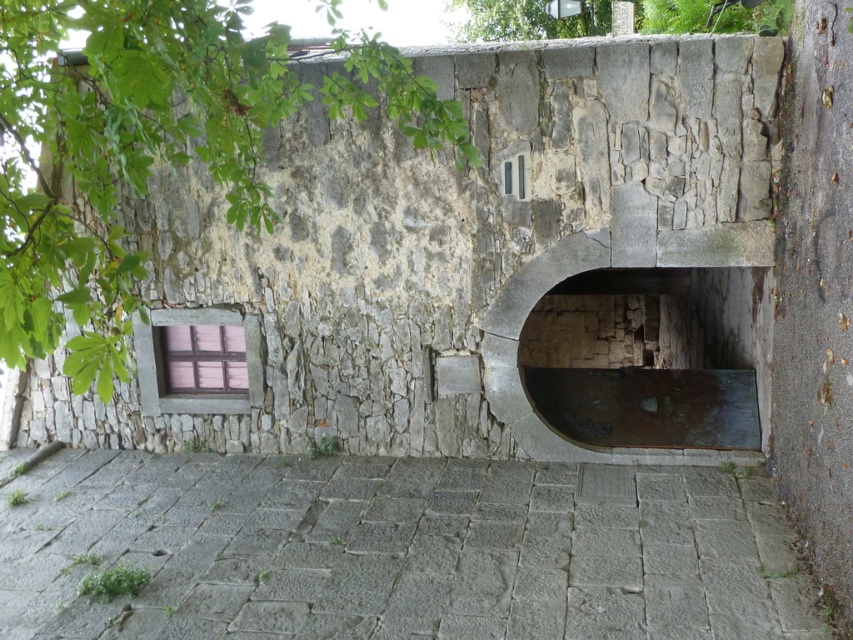
Question: Is green leafy tree at upper left smaller than bronze metallic archway at center?

Choices:
 (A) yes
 (B) no

Answer: (B)

Question: Which object is farther from the camera taking this photo?

Choices:
 (A) green leafy tree at upper left
 (B) bronze metallic archway at center
 (C) rusty metal door at center
 (D) gray stone alley at center

Answer: (B)

Question: Does rusty metal door at center lie behind bronze metallic archway at center?

Choices:
 (A) no
 (B) yes

Answer: (A)

Question: Considering the real-world distances, which object is farthest from the gray stone alley at center?

Choices:
 (A) green leafy tree at upper left
 (B) bronze metallic archway at center

Answer: (B)

Question: Among these objects, which one is farthest from the camera?

Choices:
 (A) rusty metal door at center
 (B) bronze metallic archway at center
 (C) gray stone alley at center
 (D) green leafy tree at upper center

Answer: (B)

Question: Is gray stone alley at center to the left of green leafy tree at upper left from the viewer's perspective?

Choices:
 (A) no
 (B) yes

Answer: (A)